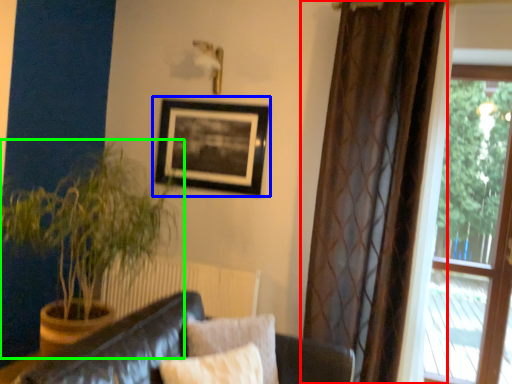
Question: Considering the real-world distances, which object is closest to curtain (highlighted by a red box)? picture frame (highlighted by a blue box) or houseplant (highlighted by a green box).

Choices:
 (A) picture frame
 (B) houseplant

Answer: (A)